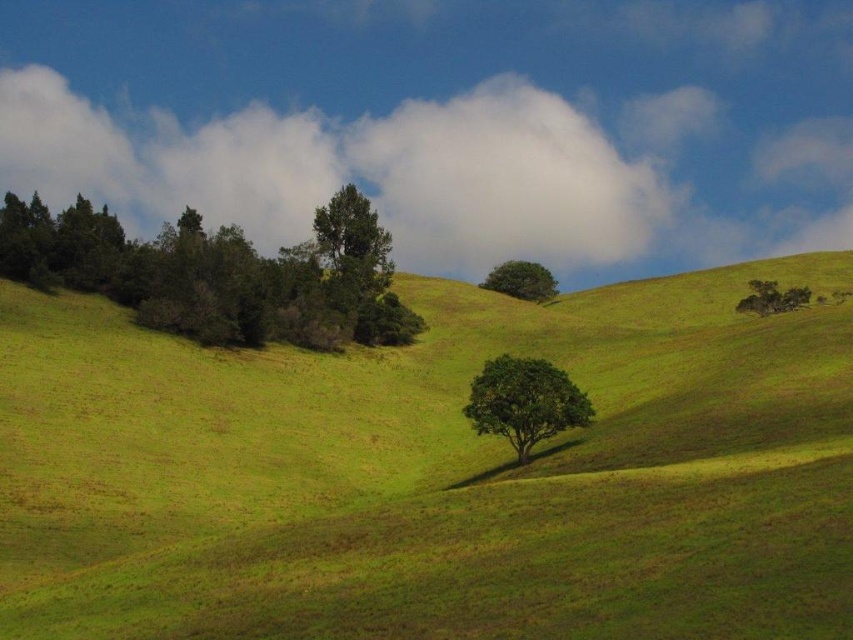
You are standing at the point with coordinates (524, 401) in this landscape. What object is located exactly at that point?

The point at coordinates (524, 401) is where the green leafy tree at center is located.

You are an environmental scientist assessing the landscape. You notice two green leafy trees in the scene. Which tree, the green leafy tree at center or the green leafy tree at upper right, has a greater height?

The green leafy tree at center is taller than the green leafy tree at upper right according to the description.

You are standing in the middle of the green grassy hillside at center and want to walk towards the green leafy tree at upper center. Which direction should you head?

A: The green grassy hillside at center is to the right of the green leafy tree at upper center, so you should head to the left to reach the tree.